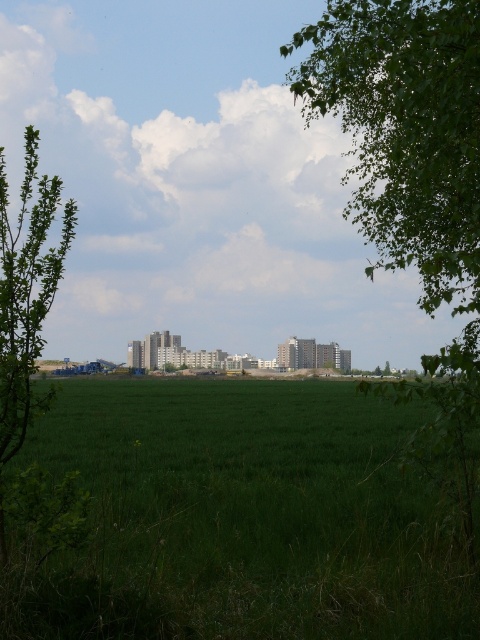
Question: Is green grassy field at lower center positioned at the back of green leafy tree at left?

Choices:
 (A) yes
 (B) no

Answer: (B)

Question: Which of the following is the closest to the observer?

Choices:
 (A) green grassy field at lower center
 (B) green leafy tree at left

Answer: (A)

Question: Which is nearer to the green leafy tree at left?

Choices:
 (A) green leafy tree at upper right
 (B) green grassy field at lower center

Answer: (A)

Question: Is green grassy field at lower center smaller than green leafy tree at upper right?

Choices:
 (A) yes
 (B) no

Answer: (A)

Question: Is green grassy field at lower center thinner than green leafy tree at left?

Choices:
 (A) yes
 (B) no

Answer: (B)

Question: Which object appears farthest from the camera in this image?

Choices:
 (A) green leafy tree at left
 (B) green leafy tree at upper right

Answer: (A)